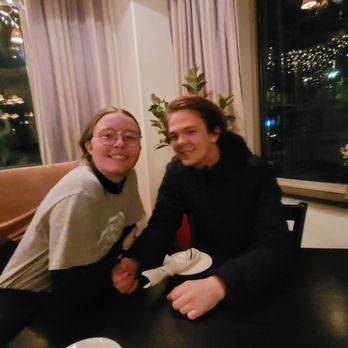
At what (x,y) coordinates should I click in order to perform the action: click on brown couch. Please return your answer as a coordinate pair (x, y). The image size is (348, 348). Looking at the image, I should click on (31, 184).